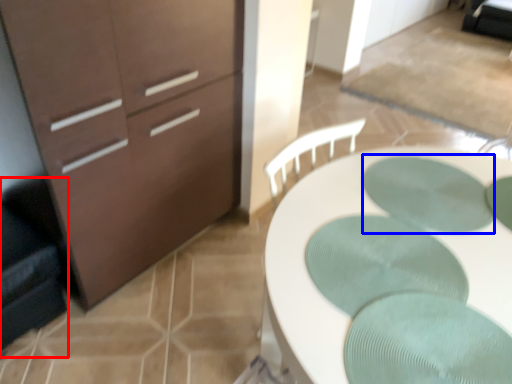
Question: Which object is further to the camera taking this photo, swivel chair (highlighted by a red box) or oval (highlighted by a blue box)?

Choices:
 (A) swivel chair
 (B) oval

Answer: (A)